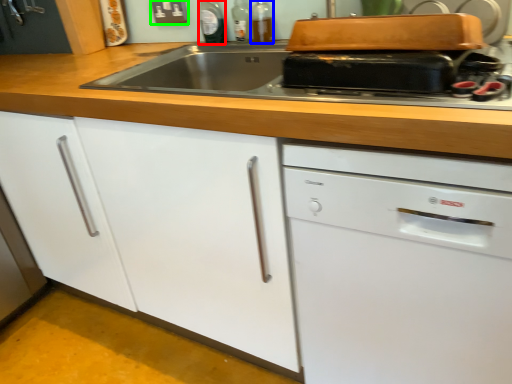
Question: Which object is positioned closest to bottle (highlighted by a red box)? Select from bottle (highlighted by a blue box) and electric outlet (highlighted by a green box).

Choices:
 (A) bottle
 (B) electric outlet

Answer: (B)